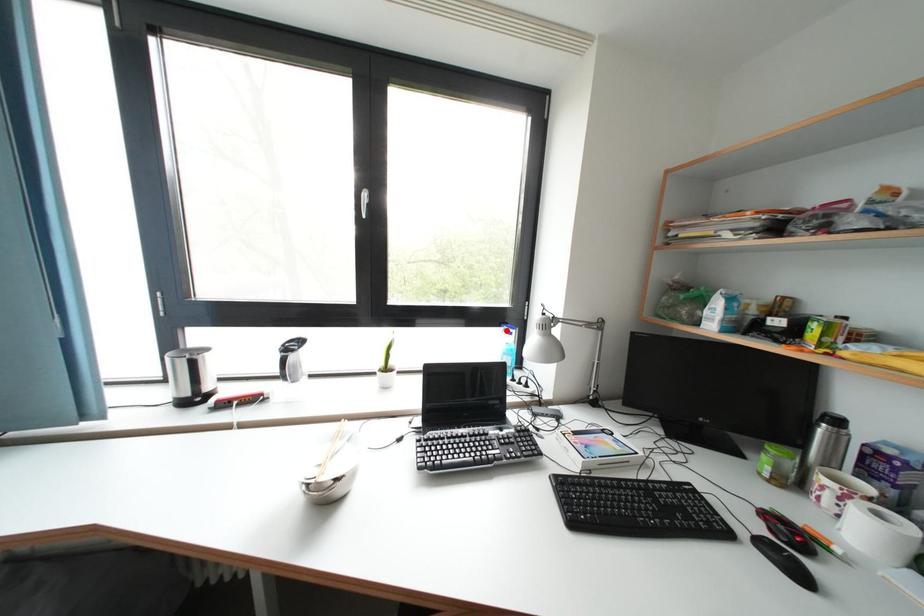
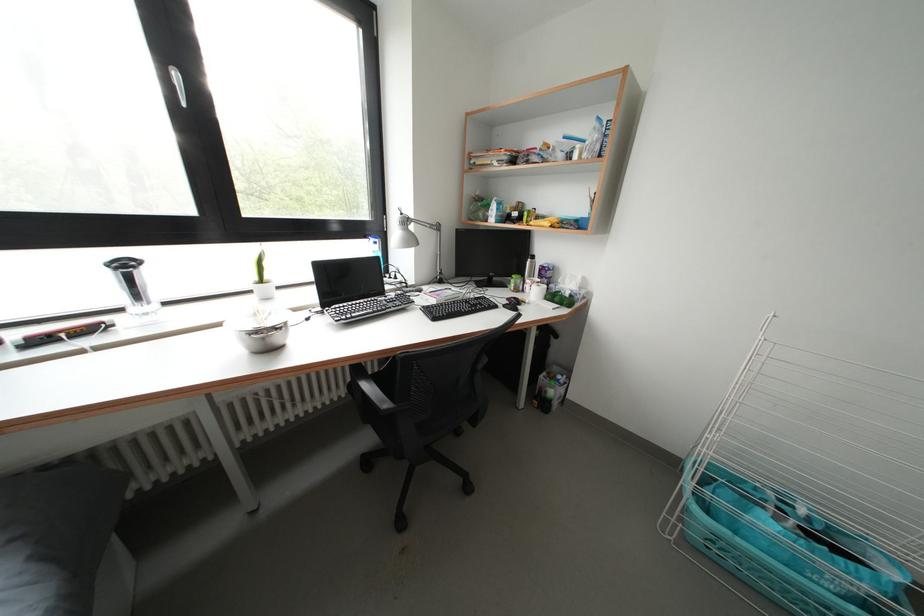
Question: I am providing you with two images of the same scene from different viewpoints. Image1 has a red point marked. In image2, the corresponding 3D location appears at what relative position? Reply with the corresponding letter.

Choices:
 (A) Closer
 (B) Farther

Answer: (A)